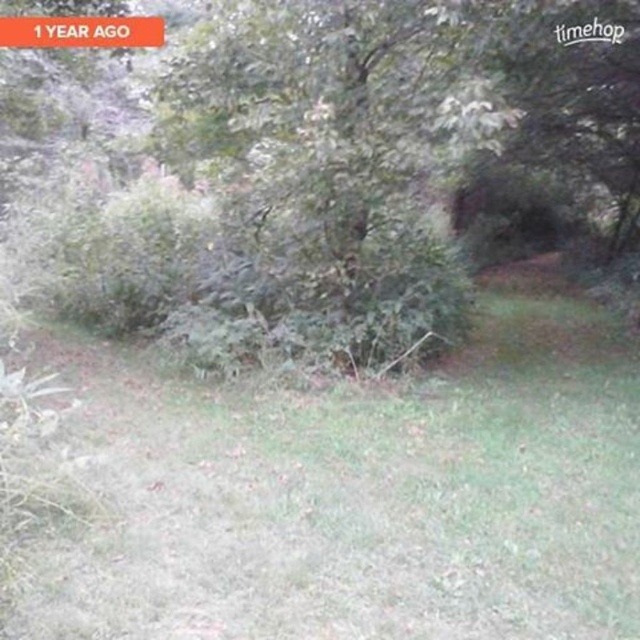
From the picture: Measure the distance between point (600, 593) and camera.

The distance of point (600, 593) from camera is 11.30 feet.

Is point (458, 406) more distant than point (211, 129)?

No, it is in front of (211, 129).

Find the location of a particular element. green grass at center is located at coordinates [358, 493].

You are a GUI agent. You are given a task and a screenshot of the screen. Output one action in this format:
    pyautogui.click(x=<x>, y=<y>)
    Task: Click on the green grass at center
    
    Given the screenshot: What is the action you would take?
    pyautogui.click(x=358, y=493)